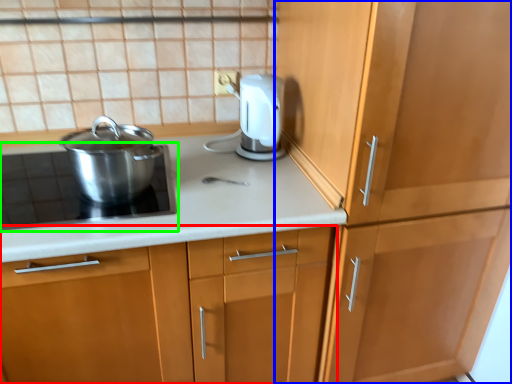
Question: Which object is the closest to the cabinetry (highlighted by a red box)? Choose among these: cabinetry (highlighted by a blue box) or home appliance (highlighted by a green box).

Choices:
 (A) cabinetry
 (B) home appliance

Answer: (B)